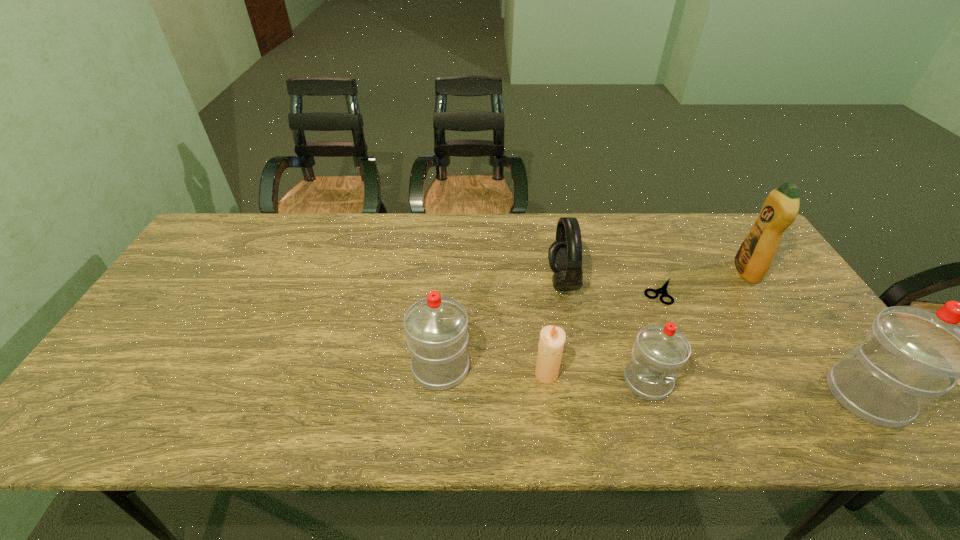
This screenshot has width=960, height=540. Find the location of `vacant area in the image that satisfies the following two spatial constraints: 1. on the label of the detergent; 2. on the handle side of the tallest water bottle`. vacant area in the image that satisfies the following two spatial constraints: 1. on the label of the detergent; 2. on the handle side of the tallest water bottle is located at coordinates (828, 396).